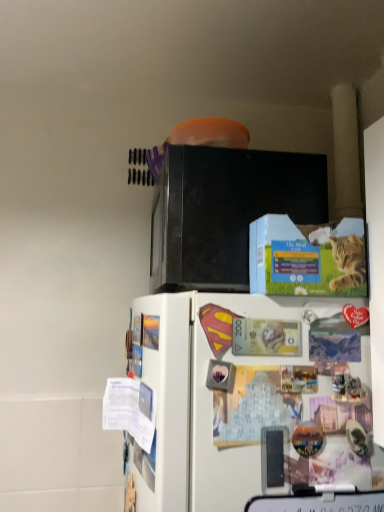
Question: From the image's perspective, does white matte refrigerator at lower center appear lower than blue cardboard box at upper center?

Choices:
 (A) no
 (B) yes

Answer: (B)

Question: From a real-world perspective, is white matte refrigerator at lower center located higher than blue cardboard box at upper center?

Choices:
 (A) yes
 (B) no

Answer: (B)

Question: From the image's perspective, does white matte refrigerator at lower center appear higher than blue cardboard box at upper center?

Choices:
 (A) no
 (B) yes

Answer: (A)

Question: Is white matte refrigerator at lower center shorter than blue cardboard box at upper center?

Choices:
 (A) yes
 (B) no

Answer: (B)

Question: Is white matte refrigerator at lower center looking in the opposite direction of blue cardboard box at upper center?

Choices:
 (A) no
 (B) yes

Answer: (A)

Question: Is point (317, 266) positioned closer to the camera than point (142, 509)?

Choices:
 (A) closer
 (B) farther

Answer: (B)

Question: Is blue cardboard box at upper center in front of or behind white matte refrigerator at lower center in the image?

Choices:
 (A) front
 (B) behind

Answer: (B)

Question: Is blue cardboard box at upper center to the left or to the right of white matte refrigerator at lower center in the image?

Choices:
 (A) right
 (B) left

Answer: (A)

Question: Which is correct: blue cardboard box at upper center is inside white matte refrigerator at lower center, or outside of it?

Choices:
 (A) inside
 (B) outside

Answer: (B)

Question: Relative to black matte microwave oven at upper center, is blue cardboard box at upper center in front or behind?

Choices:
 (A) behind
 (B) front

Answer: (B)

Question: From the image's perspective, is blue cardboard box at upper center above or below black matte microwave oven at upper center?

Choices:
 (A) below
 (B) above

Answer: (A)

Question: Would you say blue cardboard box at upper center is to the left or to the right of black matte microwave oven at upper center in the picture?

Choices:
 (A) left
 (B) right

Answer: (B)

Question: Considering the positions of blue cardboard box at upper center and black matte microwave oven at upper center in the image, is blue cardboard box at upper center taller or shorter than black matte microwave oven at upper center?

Choices:
 (A) tall
 (B) short

Answer: (B)

Question: Considering the positions of black matte microwave oven at upper center and white matte refrigerator at lower center in the image, is black matte microwave oven at upper center bigger or smaller than white matte refrigerator at lower center?

Choices:
 (A) small
 (B) big

Answer: (A)

Question: Considering the positions of black matte microwave oven at upper center and white matte refrigerator at lower center in the image, is black matte microwave oven at upper center taller or shorter than white matte refrigerator at lower center?

Choices:
 (A) tall
 (B) short

Answer: (B)